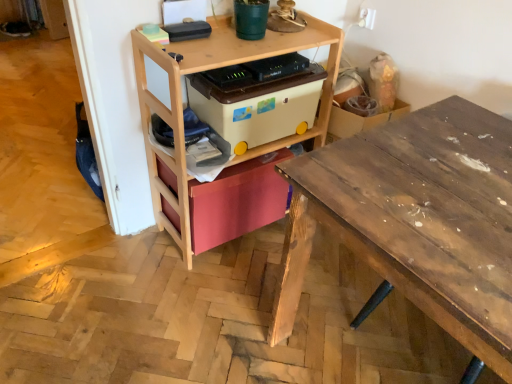
Question: Should I look upward or downward to see wooden desk at right?

Choices:
 (A) down
 (B) up

Answer: (A)

Question: Does matte pink drawer at center, the first storage box positioned from the bottom, have a greater height compared to beige plastic storage box at center, which is the 1th storage box from top to bottom?

Choices:
 (A) yes
 (B) no

Answer: (A)

Question: Considering the relative positions of matte pink drawer at center, the second storage box from the top, and beige plastic storage box at center, which is the 1th storage box from top to bottom, in the image provided, is matte pink drawer at center, the second storage box from the top, to the left of beige plastic storage box at center, which is the 1th storage box from top to bottom, from the viewer's perspective?

Choices:
 (A) yes
 (B) no

Answer: (A)

Question: Can beige plastic storage box at center, which is the 1th storage box from top to bottom, be found inside matte pink drawer at center, the first storage box positioned from the bottom?

Choices:
 (A) yes
 (B) no

Answer: (B)

Question: Considering the relative positions of matte pink drawer at center, the second storage box from the top, and beige plastic storage box at center, which is the 1th storage box from top to bottom, in the image provided, is matte pink drawer at center, the second storage box from the top, in front of beige plastic storage box at center, which is the 1th storage box from top to bottom,?

Choices:
 (A) no
 (B) yes

Answer: (A)

Question: Is matte pink drawer at center, the second storage box from the top, oriented away from beige plastic storage box at center, acting as the second storage box starting from the bottom?

Choices:
 (A) yes
 (B) no

Answer: (B)

Question: From the image's perspective, does matte pink drawer at center, the first storage box positioned from the bottom, appear higher than beige plastic storage box at center, acting as the second storage box starting from the bottom?

Choices:
 (A) no
 (B) yes

Answer: (A)

Question: Is wooden desk at right wider than wooden shelf at center?

Choices:
 (A) no
 (B) yes

Answer: (B)

Question: Is wooden desk at right in contact with wooden shelf at center?

Choices:
 (A) no
 (B) yes

Answer: (A)

Question: Does wooden desk at right come behind wooden shelf at center?

Choices:
 (A) yes
 (B) no

Answer: (B)

Question: From the image's perspective, would you say wooden desk at right is shown under wooden shelf at center?

Choices:
 (A) yes
 (B) no

Answer: (A)

Question: Is wooden desk at right taller than wooden shelf at center?

Choices:
 (A) yes
 (B) no

Answer: (B)

Question: From a real-world perspective, is wooden desk at right physically below wooden shelf at center?

Choices:
 (A) yes
 (B) no

Answer: (A)

Question: Is beige plastic storage box at center, which is the 1th storage box from top to bottom, with wooden desk at right?

Choices:
 (A) no
 (B) yes

Answer: (A)